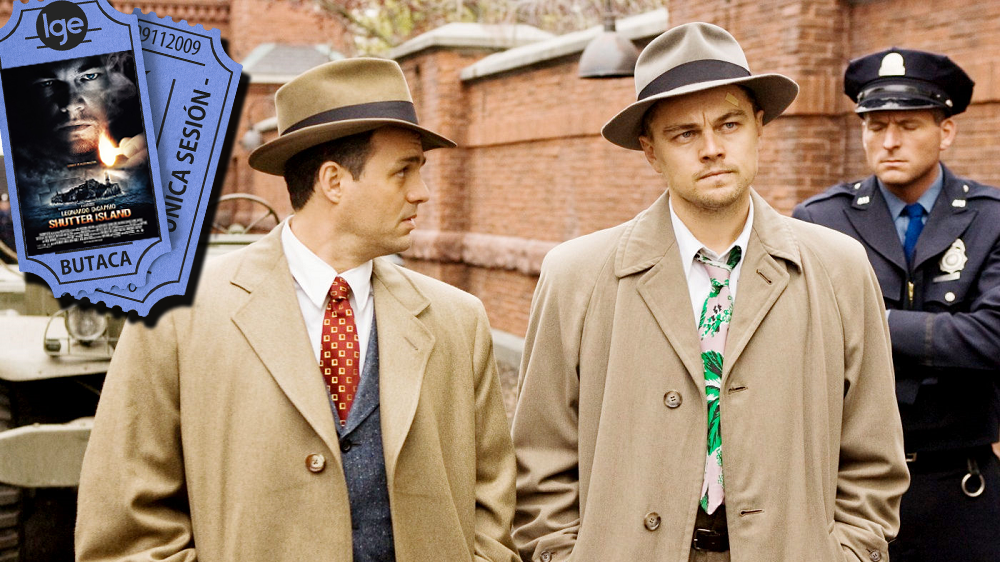
Identify the location of red brick wall. (551, 88), (529, 185), (896, 19), (987, 151), (812, 170), (507, 300).